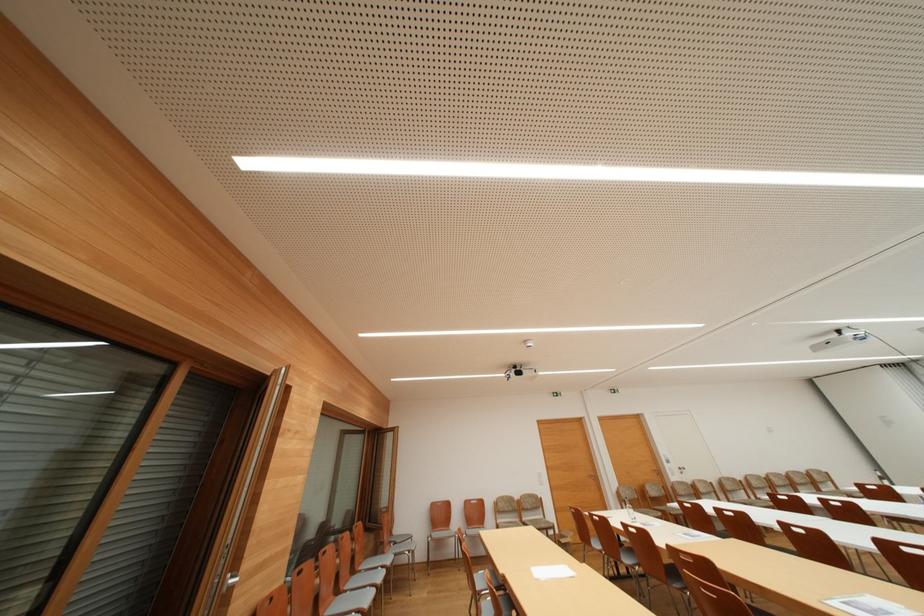
You are a GUI agent. You are given a task and a screenshot of the screen. Output one action in this format:
    pyautogui.click(x=<x>, y=<y>)
    Task: Click on the silver window handle
    The width and height of the screenshot is (924, 616).
    Given the screenshot: What is the action you would take?
    pyautogui.click(x=232, y=580)